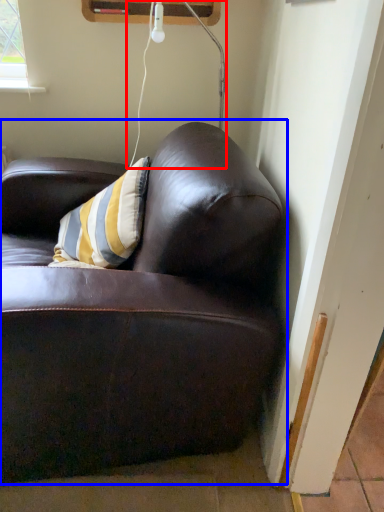
Question: Which of the following is the farthest to the observer, lamp (highlighted by a red box) or studio couch (highlighted by a blue box)?

Choices:
 (A) lamp
 (B) studio couch

Answer: (A)